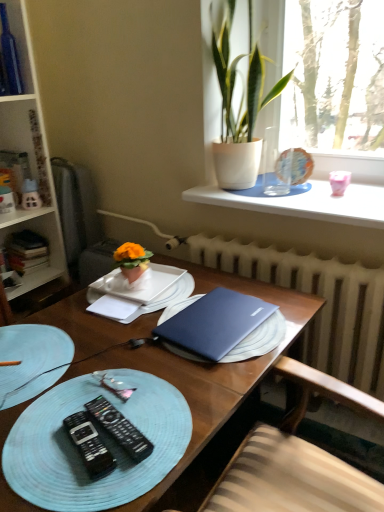
Locate an element on the screen. This screenshot has width=384, height=512. vacant area on top of blue woven placemat at lower left, the first tableware viewed from the front (from a real-world perspective) is located at coordinates (27, 348).